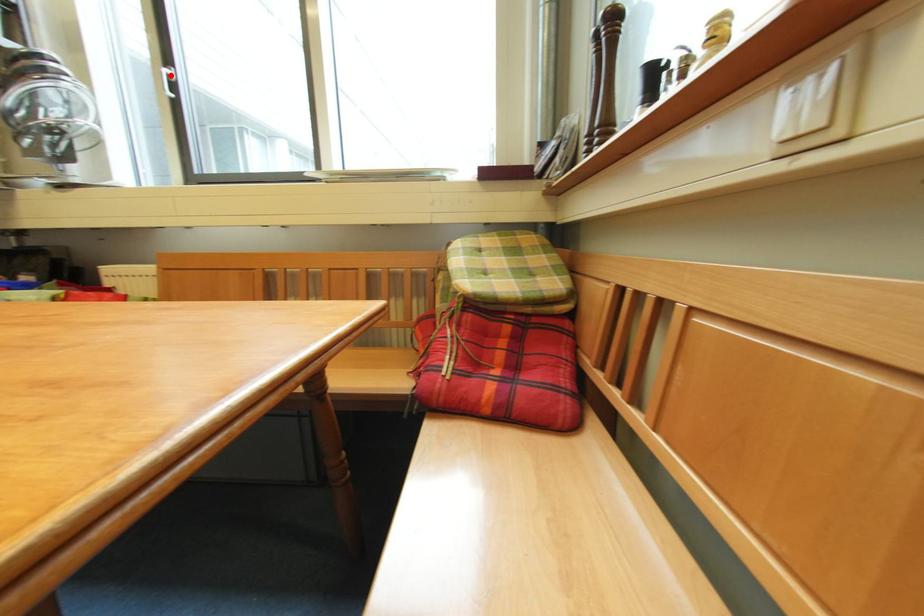
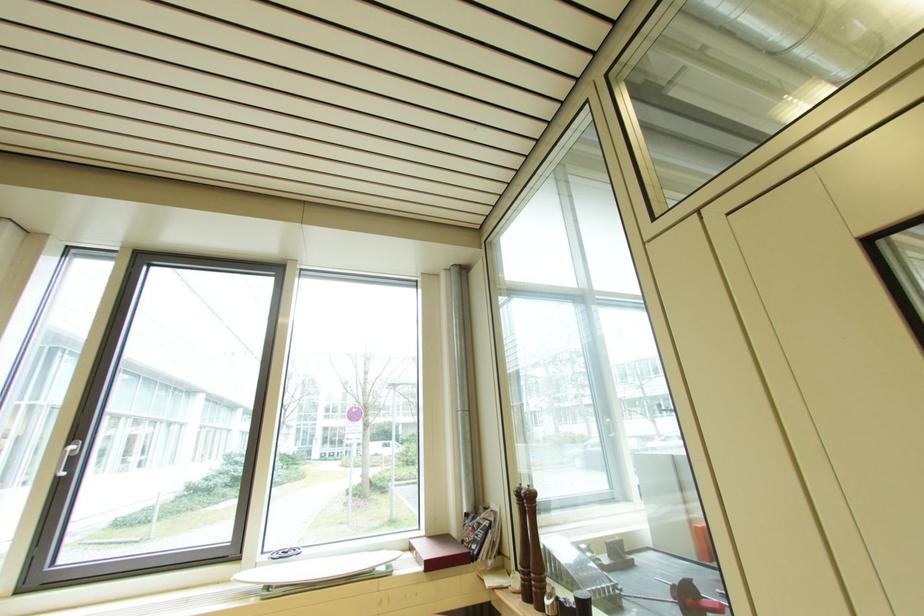
Find the pixel in the second image that matches the highlighted location in the first image.

(73, 455)